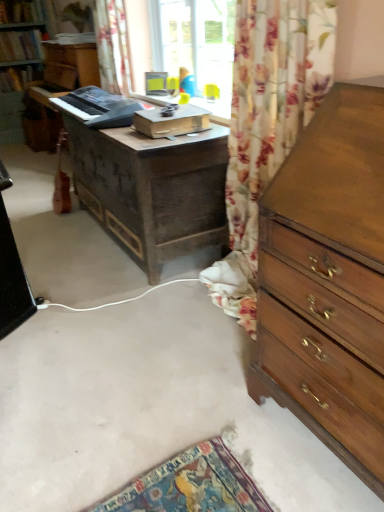
Find the location of a particular element. This screenshot has height=512, width=384. free location in front of dark brown wooden desk at center is located at coordinates (113, 313).